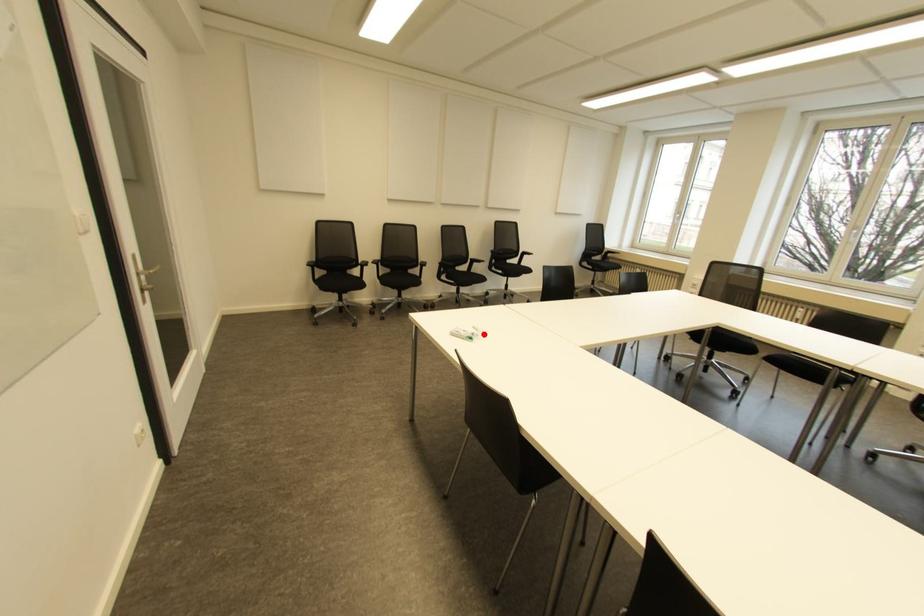
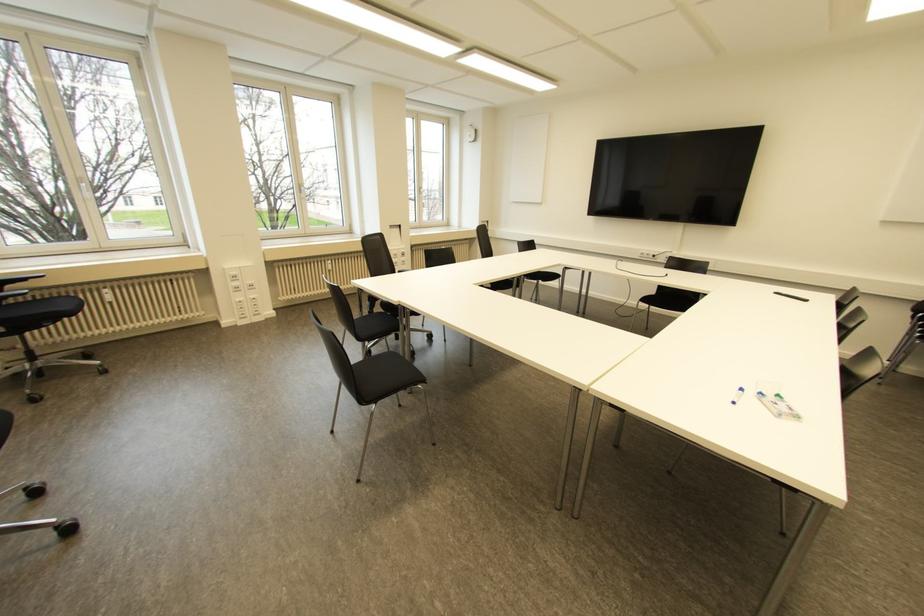
Find the pixel in the second image that matches the highlighted location in the first image.

(739, 390)